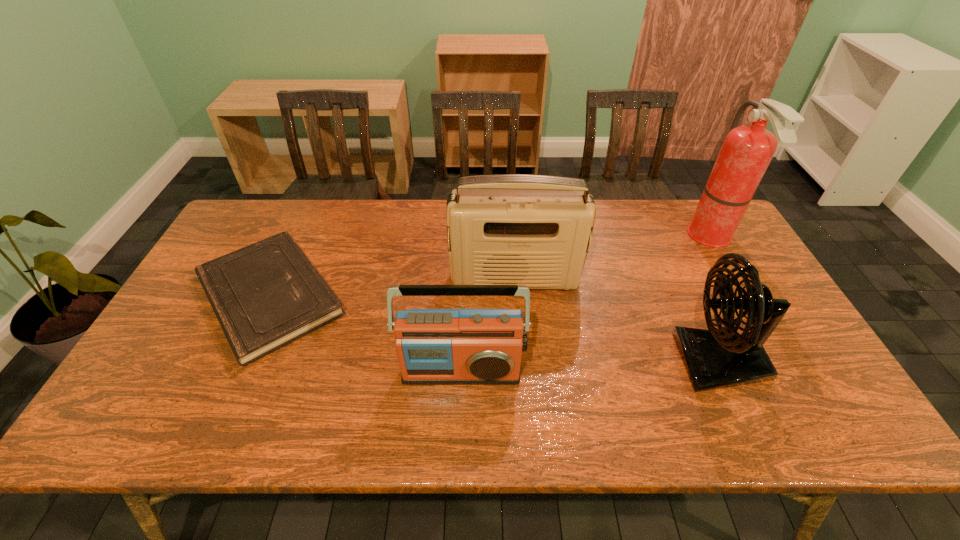
In order to click on vacant area that lies between the fire extinguisher and the second shortest object in this screenshot , I will do `click(587, 303)`.

The image size is (960, 540). Identify the location of empty location between the fan and the farther radio receiver. (617, 320).

The height and width of the screenshot is (540, 960). What are the coordinates of `vacant area that lies between the fourth tallest object and the fire extinguisher` in the screenshot? It's located at pyautogui.click(x=587, y=303).

Image resolution: width=960 pixels, height=540 pixels. In order to click on free space between the tallest object and the taller radio receiver in this screenshot , I will do `click(613, 258)`.

This screenshot has height=540, width=960. Find the location of `empty space between the taller radio receiver and the fire extinguisher`. empty space between the taller radio receiver and the fire extinguisher is located at coordinates (613, 258).

I want to click on empty location between the leftmost object and the shorter radio receiver, so point(366,333).

The height and width of the screenshot is (540, 960). I want to click on object that can be found as the closest to the nearer radio receiver, so click(266, 295).

Locate an element on the screen. The image size is (960, 540). the closest object to the tallest object is located at coordinates (715, 358).

Find the location of `vacant space that satisfies the following two spatial constraints: 1. with the handle and hose on the fire extinguisher; 2. on the front-facing side of the farther radio receiver`. vacant space that satisfies the following two spatial constraints: 1. with the handle and hose on the fire extinguisher; 2. on the front-facing side of the farther radio receiver is located at coordinates (735, 279).

Image resolution: width=960 pixels, height=540 pixels. I want to click on vacant space that satisfies the following two spatial constraints: 1. with the handle and hose on the fire extinguisher; 2. on the front-facing side of the nearer radio receiver, so click(787, 370).